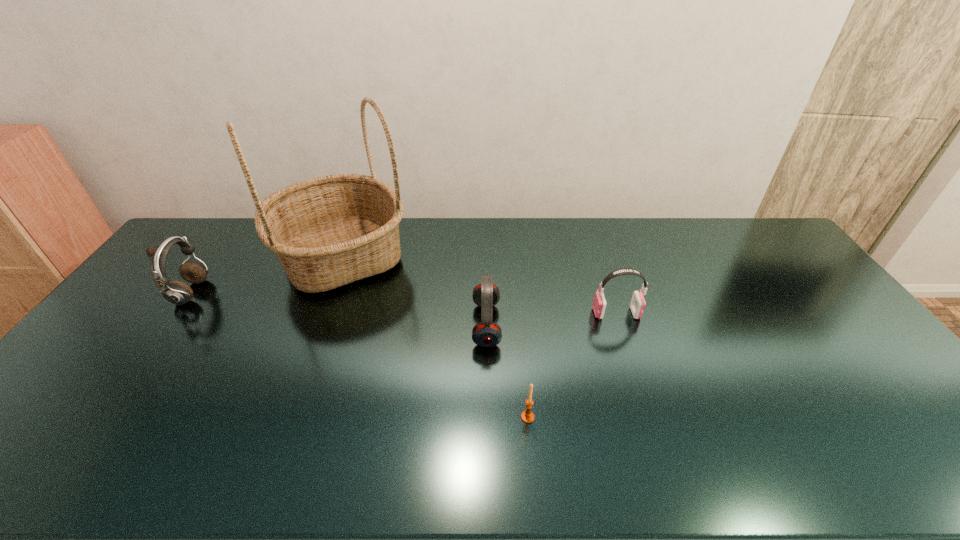
In the image, there is a desktop. What are the coordinates of `vacant space at the near edge` in the screenshot? It's located at (606, 463).

This screenshot has height=540, width=960. I want to click on free space at the left edge, so [97, 387].

This screenshot has height=540, width=960. I want to click on blank region between the second object from left to right and the second earphone from left to right, so click(x=414, y=291).

At what (x,y) coordinates should I click in order to perform the action: click on unoccupied position between the fourth object from right to left and the tallest earphone. Please return your answer as a coordinate pair (x, y). Looking at the image, I should click on (266, 275).

The image size is (960, 540). I want to click on free space between the fourth object from left to right and the basket, so click(x=435, y=337).

Locate an element on the screen. Image resolution: width=960 pixels, height=540 pixels. vacant area that lies between the second earphone from right to left and the nearest object is located at coordinates (507, 371).

Where is `free space between the third object from left to right and the basket`? The height and width of the screenshot is (540, 960). free space between the third object from left to right and the basket is located at coordinates (414, 291).

In order to click on vacant space that is in between the third object from right to left and the nearest object in this screenshot , I will do `click(507, 371)`.

This screenshot has width=960, height=540. Find the location of `free space between the second earphone from left to right and the second object from left to right`. free space between the second earphone from left to right and the second object from left to right is located at coordinates (414, 291).

You are a GUI agent. You are given a task and a screenshot of the screen. Output one action in this format:
    pyautogui.click(x=<x>, y=<y>)
    Task: Click on the free space between the leftmost object and the rightmost earphone
    The image size is (960, 540).
    Given the screenshot: What is the action you would take?
    pyautogui.click(x=403, y=303)